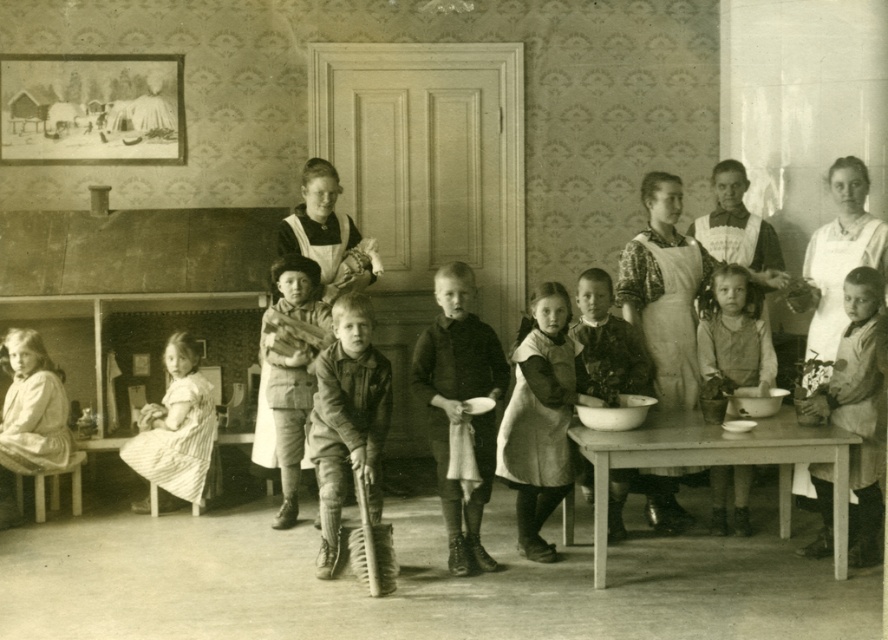
Can you confirm if light brown fabric dress at center is positioned to the right of matte brown apron at lower right?

In fact, light brown fabric dress at center is to the left of matte brown apron at lower right.

Is light brown fabric dress at center below matte brown apron at lower right?

Yes.

This screenshot has height=640, width=888. Find the location of `light brown fabric dress at center`. light brown fabric dress at center is located at coordinates (540, 419).

Which is in front, point (496, 376) or point (577, 301)?

Point (496, 376) is in front.

In the scene shown: Which is above, dark brown leather shoes at center or dark brown fabric dress at center?

dark brown fabric dress at center

Is point (422, 403) positioned in front of point (622, 358)?

That is False.

The width and height of the screenshot is (888, 640). In order to click on dark brown leather shoes at center in this screenshot , I will do `click(458, 404)`.

Who is positioned more to the right, wooden table at center or dark brown leather shoes at center?

wooden table at center is more to the right.

Can you confirm if wooden table at center is positioned to the right of dark brown leather shoes at center?

Yes, wooden table at center is to the right of dark brown leather shoes at center.

Where is `wooden table at center`? wooden table at center is located at coordinates (718, 461).

Identify the location of wooden table at center. This screenshot has width=888, height=640. (718, 461).